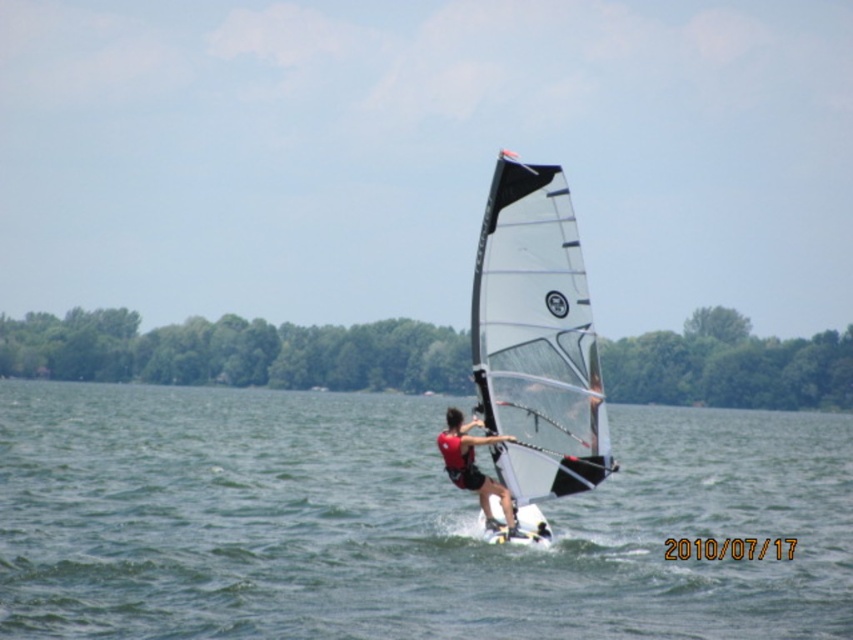
Who is shorter, clear water at center or transparent plastic sail at center?

clear water at center

Does clear water at center have a greater height compared to transparent plastic sail at center?

No, clear water at center is not taller than transparent plastic sail at center.

Between point (242, 484) and point (517, 460), which one is positioned behind?

The point (242, 484) is behind.

Identify the location of clear water at center. (397, 522).

Describe the element at coordinates (397, 522) in the screenshot. This screenshot has height=640, width=853. I see `clear water at center` at that location.

The height and width of the screenshot is (640, 853). I want to click on clear water at center, so click(x=397, y=522).

Locate an element on the screen. Image resolution: width=853 pixels, height=640 pixels. clear water at center is located at coordinates (397, 522).

Who is positioned more to the right, transparent plastic sail at center or red matte life vest at center?

transparent plastic sail at center is more to the right.

Measure the distance between transparent plastic sail at center and camera.

transparent plastic sail at center is 29.02 meters away from camera.

Locate an element on the screen. The height and width of the screenshot is (640, 853). transparent plastic sail at center is located at coordinates (537, 342).